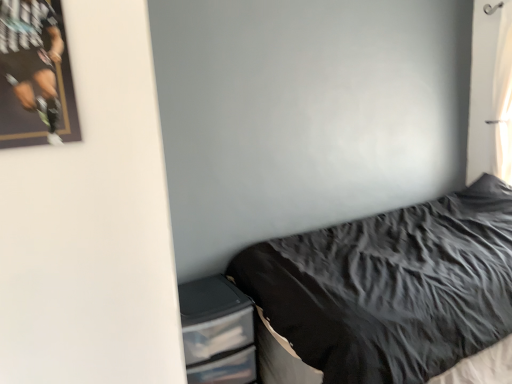
Question: Should I look upward or downward to see white sheer curtain at upper right?

Choices:
 (A) up
 (B) down

Answer: (A)

Question: Is white sheer curtain at upper right thinner than black textured fabric at lower right?

Choices:
 (A) yes
 (B) no

Answer: (A)

Question: Considering the relative positions of white sheer curtain at upper right and black textured fabric at lower right in the image provided, is white sheer curtain at upper right to the right of black textured fabric at lower right from the viewer's perspective?

Choices:
 (A) no
 (B) yes

Answer: (B)

Question: Considering the relative sizes of white sheer curtain at upper right and black textured fabric at lower right in the image provided, is white sheer curtain at upper right bigger than black textured fabric at lower right?

Choices:
 (A) no
 (B) yes

Answer: (A)

Question: Are white sheer curtain at upper right and black textured fabric at lower right making contact?

Choices:
 (A) no
 (B) yes

Answer: (A)

Question: Is white sheer curtain at upper right far from black textured fabric at lower right?

Choices:
 (A) yes
 (B) no

Answer: (A)

Question: Is white sheer curtain at upper right oriented away from black textured fabric at lower right?

Choices:
 (A) no
 (B) yes

Answer: (A)

Question: Is black textured fabric at lower right at the right side of clear plastic drawers at lower left?

Choices:
 (A) no
 (B) yes

Answer: (B)

Question: Does black textured fabric at lower right have a lesser height compared to clear plastic drawers at lower left?

Choices:
 (A) yes
 (B) no

Answer: (B)

Question: From a real-world perspective, is black textured fabric at lower right under clear plastic drawers at lower left?

Choices:
 (A) no
 (B) yes

Answer: (A)

Question: Are black textured fabric at lower right and clear plastic drawers at lower left beside each other?

Choices:
 (A) no
 (B) yes

Answer: (A)

Question: Is black textured fabric at lower right at the left side of clear plastic drawers at lower left?

Choices:
 (A) no
 (B) yes

Answer: (A)

Question: Is black textured fabric at lower right positioned with its back to clear plastic drawers at lower left?

Choices:
 (A) no
 (B) yes

Answer: (A)

Question: From a real-world perspective, is black textured fabric at lower right physically above white sheer curtain at upper right?

Choices:
 (A) no
 (B) yes

Answer: (A)